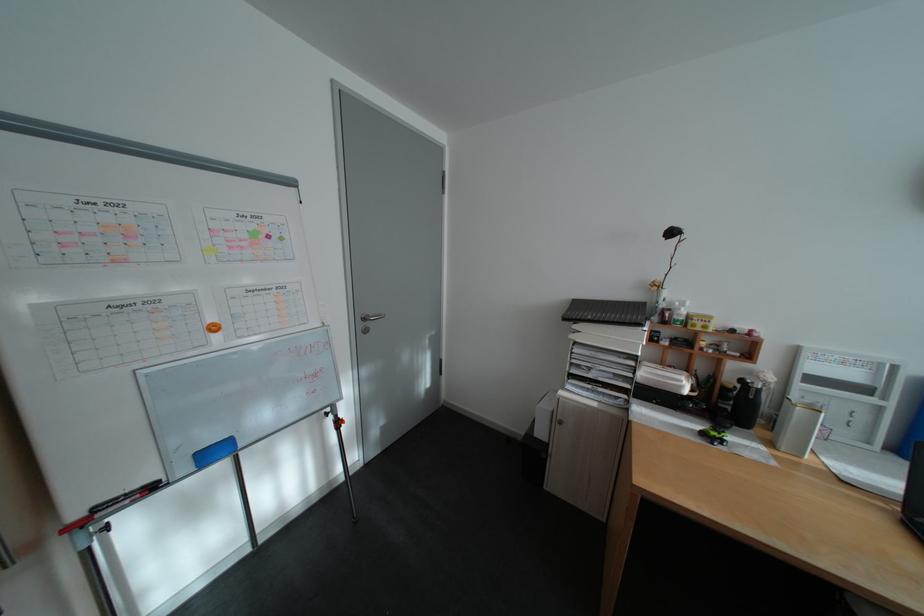
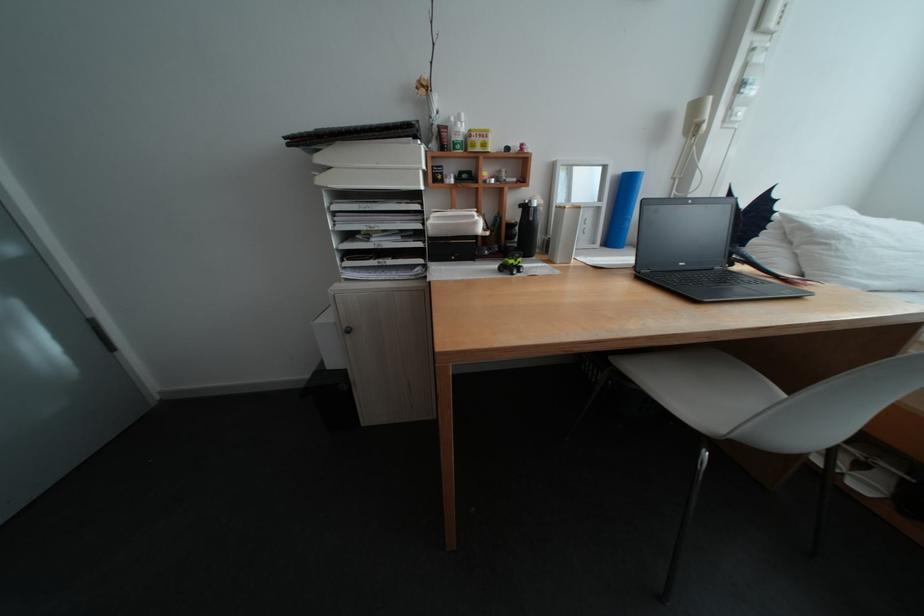
Based on the continuous images, in which direction is the camera rotating?

The camera's rotation is toward right-down.